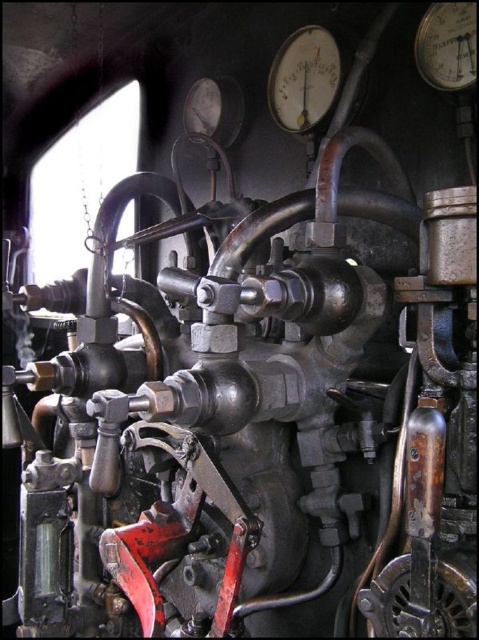
Consider the image. You are a mechanic inspecting the control panel of a steam locomotive. You notice a metallic gauge at upper center. Based on the coordinates provided, can you confirm if this gauge is located at the point marked by point (304, 77)?

Yes, the point (304, 77) marks the metallic gauge at upper center.

You are an engineer inspecting the control panel of a steam locomotive. You notice two metallic gauges on the panel. The first is the metallic gauge at upper center, and the second is the metallic gauge at upper right. Which gauge has a larger display area?

The metallic gauge at upper center has a larger display area than the metallic gauge at upper right.